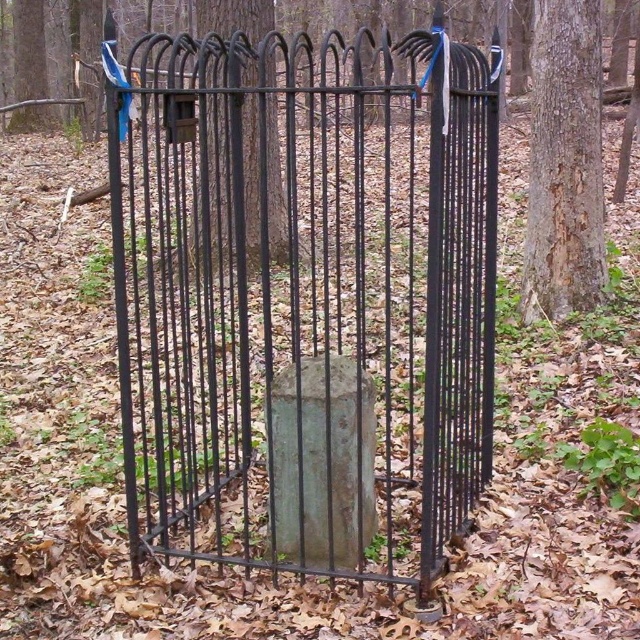
Who is shorter, black wrought iron gate at center or matte black gate at center?

Standing shorter between the two is black wrought iron gate at center.

Is black wrought iron gate at center shorter than matte black gate at center?

Indeed, black wrought iron gate at center has a lesser height compared to matte black gate at center.

Describe the element at coordinates (305, 294) in the screenshot. This screenshot has width=640, height=640. I see `black wrought iron gate at center` at that location.

Locate an element on the screen. The width and height of the screenshot is (640, 640). black wrought iron gate at center is located at coordinates (305, 294).

Can you confirm if matte black gate at center is positioned to the left of black metal fence at center?

Correct, you'll find matte black gate at center to the left of black metal fence at center.

Does point (326, 13) come closer to viewer compared to point (259, 124)?

No, it is behind (259, 124).

The height and width of the screenshot is (640, 640). Identify the location of matte black gate at center. [x=67, y=51].

Does matte black gate at center appear over smooth brown bark at right?

Yes.

Does matte black gate at center have a smaller size compared to smooth brown bark at right?

No.

The height and width of the screenshot is (640, 640). In order to click on matte black gate at center in this screenshot , I will do `click(67, 51)`.